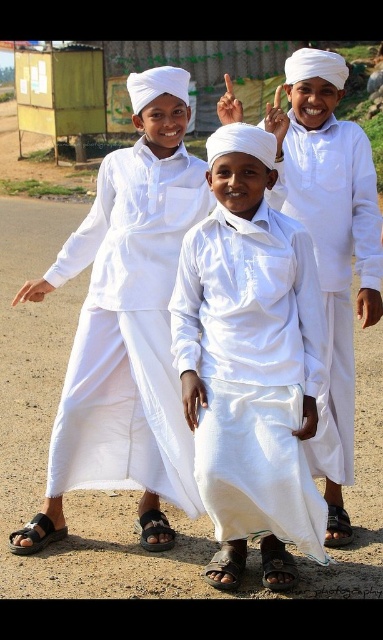
Question: Observing the image, what is the correct spatial positioning of white cotton shirt at center in reference to brown leather sandal at lower center?

Choices:
 (A) right
 (B) left

Answer: (A)

Question: Among these points, which one is nearest to the camera?

Choices:
 (A) (13, 102)
 (B) (342, 138)
 (C) (152, 536)

Answer: (C)

Question: Which object is the farthest from the white satin robe at center?

Choices:
 (A) black leather sandal at lower left
 (B) brown leather sandal at lower center
 (C) white cotton shirt at center
 (D) white cotton robe at center

Answer: (A)

Question: Among these objects, which one is nearest to the camera?

Choices:
 (A) white cotton shirt at center
 (B) brown leather sandal at lower center
 (C) black leather sandal at lower left
 (D) brown dirt field at lower left

Answer: (A)

Question: Can you confirm if black leather sandal at lower left is positioned below brown leather sandal at lower center?

Choices:
 (A) yes
 (B) no

Answer: (B)

Question: Does black leather sandal at lower left appear under brown leather sandal at lower center?

Choices:
 (A) yes
 (B) no

Answer: (B)